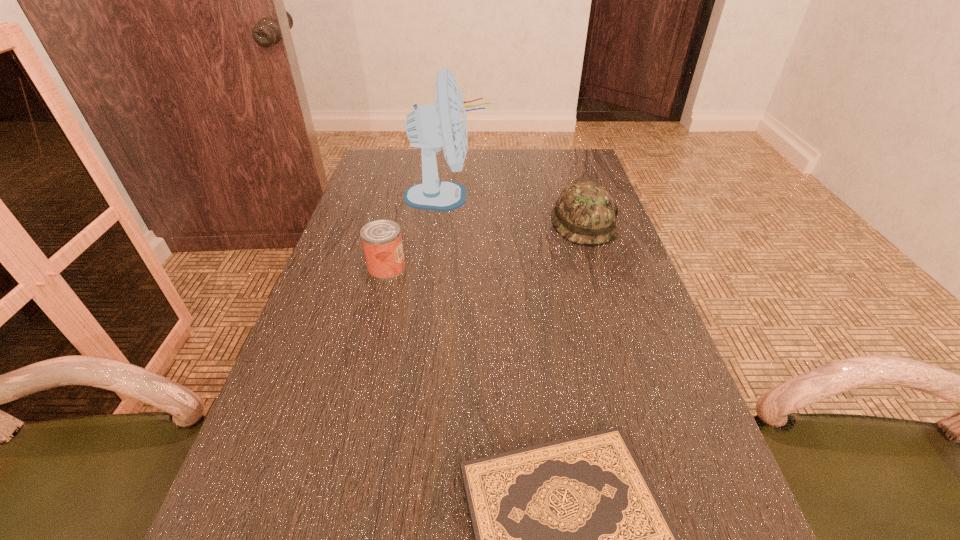
The width and height of the screenshot is (960, 540). What are the coordinates of `object positioned at the far left corner` in the screenshot? It's located at (444, 124).

At what (x,y) coordinates should I click in order to perform the action: click on free point at the far edge. Please return your answer as a coordinate pair (x, y). Image resolution: width=960 pixels, height=540 pixels. Looking at the image, I should click on (489, 171).

This screenshot has width=960, height=540. Identify the location of vacant space at the left edge. (249, 470).

The width and height of the screenshot is (960, 540). I want to click on free space at the right edge, so click(587, 340).

You are a GUI agent. You are given a task and a screenshot of the screen. Output one action in this format:
    pyautogui.click(x=<x>, y=<y>)
    Task: Click on the free space at the far left corner of the desktop
    This screenshot has height=540, width=960.
    Given the screenshot: What is the action you would take?
    pyautogui.click(x=397, y=153)

Find the location of a particular element. Image resolution: width=960 pixels, height=540 pixels. free space at the far right corner of the desktop is located at coordinates (576, 159).

This screenshot has height=540, width=960. In order to click on free spot between the headwear and the can in this screenshot , I will do `click(485, 246)`.

You are a GUI agent. You are given a task and a screenshot of the screen. Output one action in this format:
    pyautogui.click(x=<x>, y=<y>)
    Task: Click on the free spot between the headwear and the fan
    This screenshot has height=540, width=960.
    Given the screenshot: What is the action you would take?
    pyautogui.click(x=516, y=210)

At what (x,y) coordinates should I click in order to perform the action: click on blank region between the can and the headwear. Please return your answer as a coordinate pair (x, y). Looking at the image, I should click on (485, 246).

This screenshot has height=540, width=960. What are the coordinates of `free area in between the second nearest object and the headwear` in the screenshot? It's located at pyautogui.click(x=485, y=246).